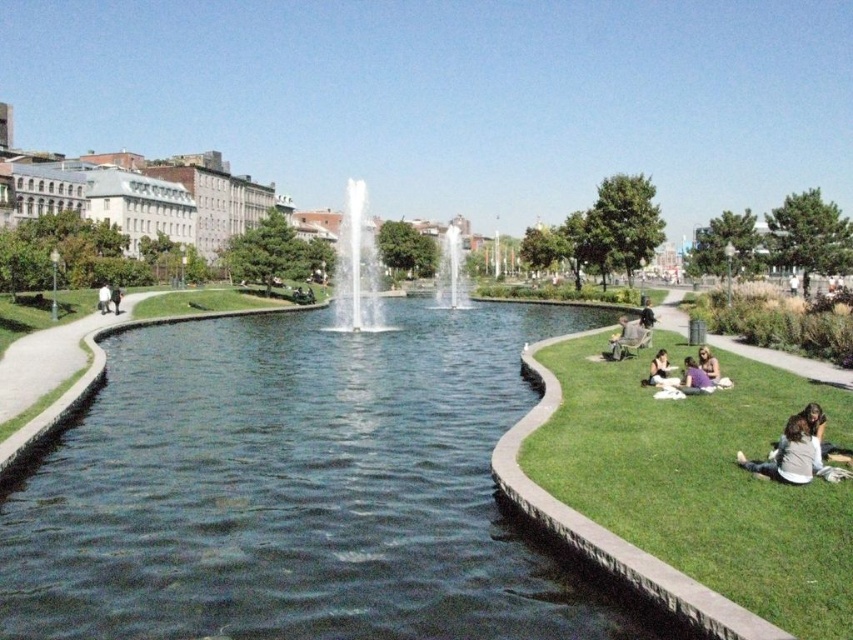
Question: Based on their relative distances, which object is farther from the white fabric person at lower right?

Choices:
 (A) white fabric bag at lower left
 (B) green grass at lower right
 (C) dark gray jacket at center

Answer: (A)

Question: Is white fabric person at lower right bigger than green fabric jacket at center?

Choices:
 (A) yes
 (B) no

Answer: (B)

Question: Is green grass at lower right to the right of white glossy fountain at center from the viewer's perspective?

Choices:
 (A) yes
 (B) no

Answer: (A)

Question: Which object is positioned farthest from the clear glass water at center?

Choices:
 (A) light brown hair at lower right
 (B) white glossy fountain at center
 (C) white fabric bag at lower left
 (D) dark brown hair at lower right

Answer: (A)

Question: Can you confirm if light purple fabric at lower right is thinner than dark gray jacket at center?

Choices:
 (A) yes
 (B) no

Answer: (A)

Question: Which object is farther from the camera taking this photo?

Choices:
 (A) green fabric jacket at center
 (B) light purple fabric at lower right

Answer: (A)